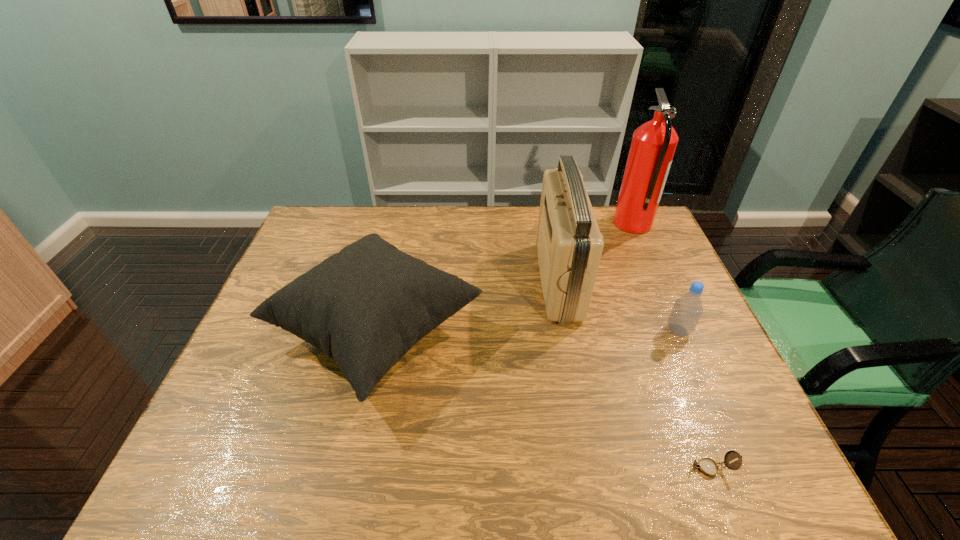
Image resolution: width=960 pixels, height=540 pixels. In order to click on vacant area that lies between the cushion and the shortest object in this screenshot , I will do `click(543, 400)`.

I want to click on free spot between the third tallest object and the fourth tallest object, so click(x=527, y=332).

Locate an element on the screen. Image resolution: width=960 pixels, height=540 pixels. the fourth closest object to the third tallest object is located at coordinates (687, 310).

The height and width of the screenshot is (540, 960). Identify the location of object identified as the third closest to the radio receiver. (687, 310).

The height and width of the screenshot is (540, 960). I want to click on vacant space that satisfies the following two spatial constraints: 1. at the nozzle of the tallest object; 2. on the front side of the leftmost object, so [681, 332].

Where is `free space that satisfies the following two spatial constraints: 1. on the front-facing side of the fourth shortest object; 2. on the back side of the second shortest object`? The image size is (960, 540). free space that satisfies the following two spatial constraints: 1. on the front-facing side of the fourth shortest object; 2. on the back side of the second shortest object is located at coordinates (568, 330).